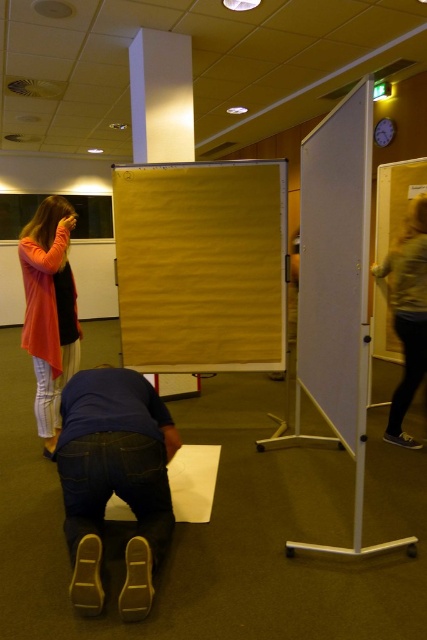
You are standing in the conference room and want to place a small box on the floor. The box is exactly at point (114,481). What object is located at that point?

The dark blue jeans at lower center is located at point (114,481).

You are standing in the conference room and need to place a new poster on the wall. The poster requires a hook at the same height as the matte orange cardigan at left. Where should you place the hook horizontally?

The matte orange cardigan at left is located at point 0.486 on the horizontal axis, so you should place the hook at the horizontal position 0.486 to match its height.

You are organizing a clothing donation drive and need to stack the matte orange cardigan at left and the light brown leather jacket at right vertically in a storage box. Given their height difference, which one should you place at the bottom to ensure stability?

The matte orange cardigan at left should be placed at the bottom since it has a greater height than the light brown leather jacket at right, providing a stable base.